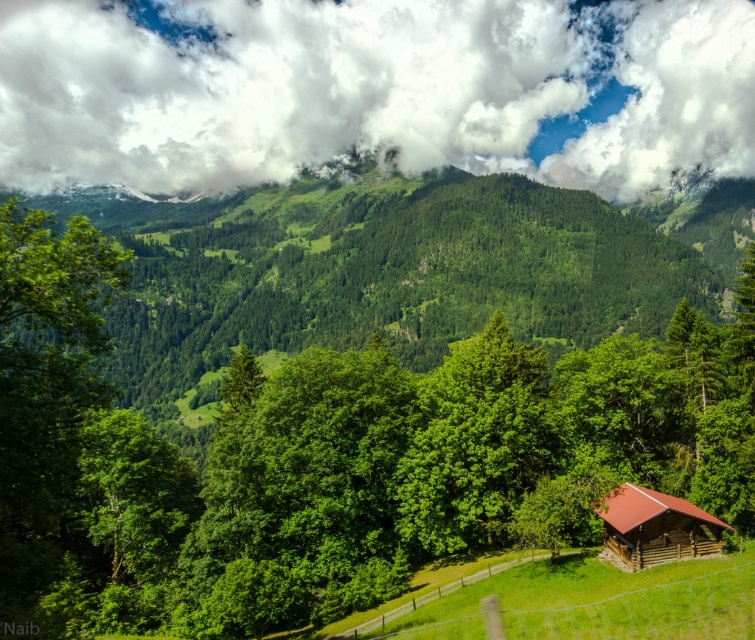
You are standing in the meadow in front of the cabin and looking towards the mountains. There is a point marked at coordinates (371, 90) in the image. What object is located at this point?

The point at coordinates (371, 90) marks a white fluffy cloud at upper center in the image.

You are standing in the meadow looking towards the mountains. You see a green leafy tree at center and a white fluffy cloud at upper center. Which object is positioned to the left of the other?

The green leafy tree at center is to the left of white fluffy cloud at upper center.